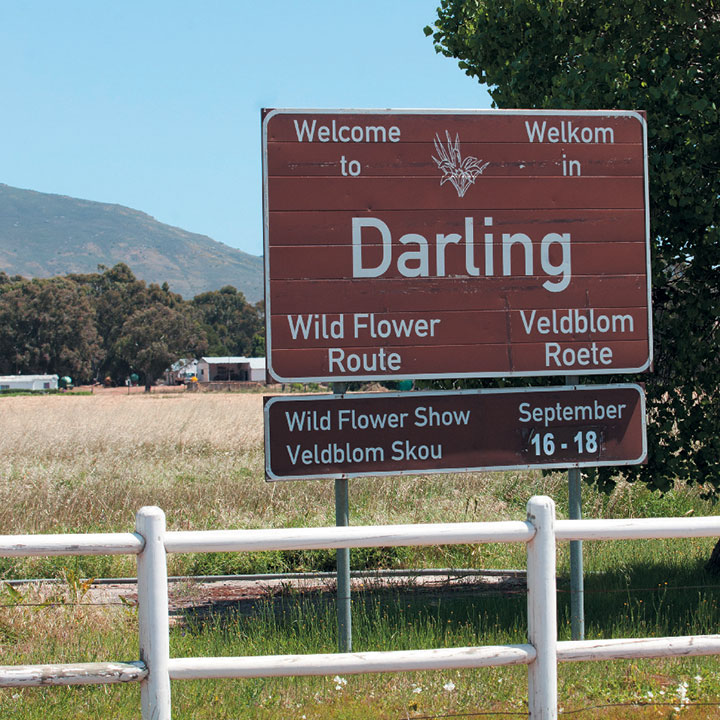
Where is `homes`? homes is located at coordinates (35, 379), (219, 366), (194, 374), (261, 371).